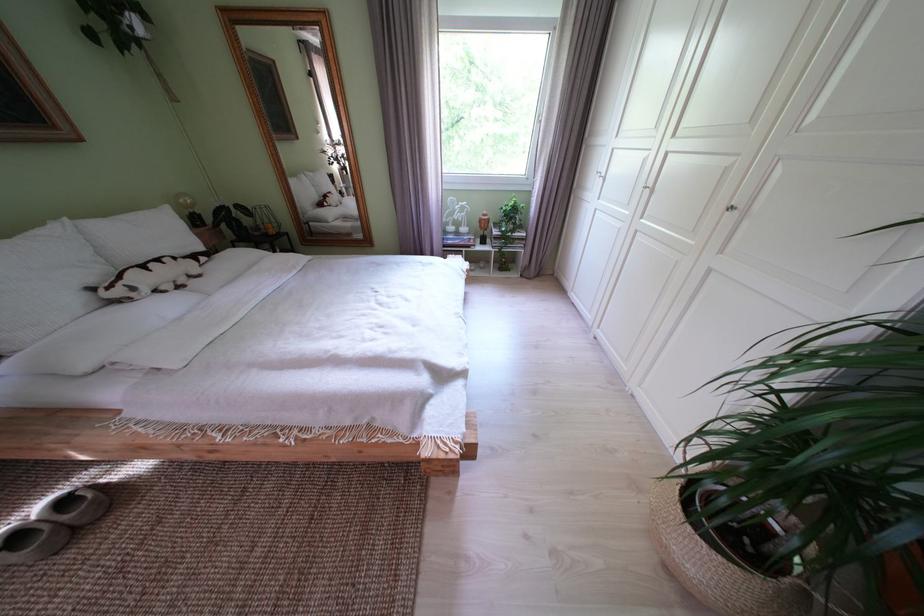
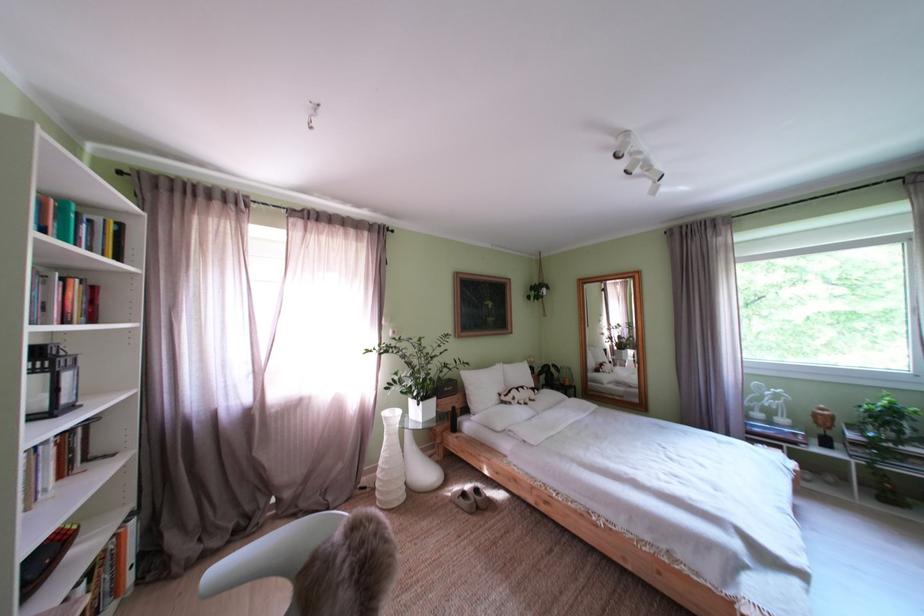
In the second image, find the point that corresponds to the point at 205,278 in the first image.

(543, 403)